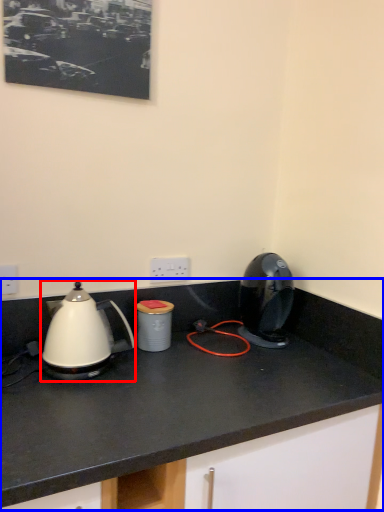
Question: Which of the following is the farthest to the observer, kettle (highlighted by a red box) or countertop (highlighted by a blue box)?

Choices:
 (A) kettle
 (B) countertop

Answer: (A)